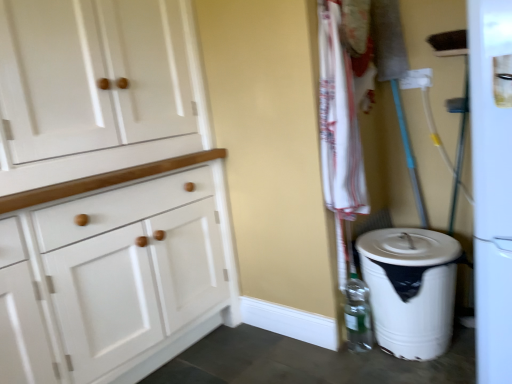
Question: Is white plastic trash can at lower right located outside white wood cabinet at left?

Choices:
 (A) no
 (B) yes

Answer: (B)

Question: Considering the relative sizes of white plastic trash can at lower right and white wood cabinet at left in the image provided, is white plastic trash can at lower right thinner than white wood cabinet at left?

Choices:
 (A) yes
 (B) no

Answer: (B)

Question: Would you say white plastic trash can at lower right contains white wood cabinet at left?

Choices:
 (A) no
 (B) yes

Answer: (A)

Question: Can you confirm if white plastic trash can at lower right is bigger than white wood cabinet at left?

Choices:
 (A) no
 (B) yes

Answer: (A)

Question: From the image's perspective, does white plastic trash can at lower right appear lower than white wood cabinet at left?

Choices:
 (A) yes
 (B) no

Answer: (A)

Question: Is white plastic trash can at lower right to the left of white wood cabinet at left from the viewer's perspective?

Choices:
 (A) yes
 (B) no

Answer: (B)

Question: From the image's perspective, would you say clear plastic bottle at lower right is positioned over white plastic trash can at lower right?

Choices:
 (A) yes
 (B) no

Answer: (B)

Question: Can you confirm if clear plastic bottle at lower right is thinner than white plastic trash can at lower right?

Choices:
 (A) yes
 (B) no

Answer: (A)

Question: Is white plastic trash can at lower right located within clear plastic bottle at lower right?

Choices:
 (A) yes
 (B) no

Answer: (B)

Question: Could you tell me if clear plastic bottle at lower right is facing white plastic trash can at lower right?

Choices:
 (A) yes
 (B) no

Answer: (A)

Question: Is clear plastic bottle at lower right in front of white plastic trash can at lower right?

Choices:
 (A) no
 (B) yes

Answer: (A)

Question: Does clear plastic bottle at lower right have a larger size compared to white plastic trash can at lower right?

Choices:
 (A) yes
 (B) no

Answer: (B)

Question: Considering the relative sizes of white cotton towel at center-right and clear plastic bottle at lower right in the image provided, is white cotton towel at center-right smaller than clear plastic bottle at lower right?

Choices:
 (A) no
 (B) yes

Answer: (A)